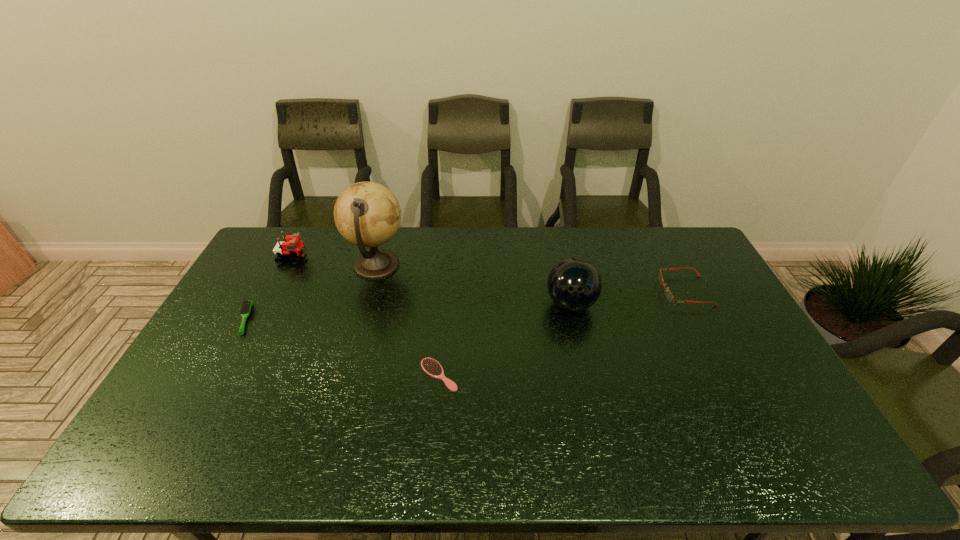
Locate an element on the screen. the tallest object is located at coordinates (367, 214).

Where is `the third object from left to right`? The width and height of the screenshot is (960, 540). the third object from left to right is located at coordinates (367, 214).

Where is `bowling ball`? bowling ball is located at coordinates (574, 285).

Locate an element on the screen. the second tallest object is located at coordinates (574, 285).

Find the location of a particular element. Lego is located at coordinates (292, 247).

The height and width of the screenshot is (540, 960). I want to click on spectacles, so click(669, 296).

Locate an element on the screen. Image resolution: width=960 pixels, height=540 pixels. the rightmost object is located at coordinates (669, 296).

What are the coordinates of `the left hairbrush` in the screenshot? It's located at (245, 309).

Find the location of `the fifth tallest object`. the fifth tallest object is located at coordinates (245, 309).

You are a GUI agent. You are given a task and a screenshot of the screen. Output one action in this format:
    pyautogui.click(x=<x>, y=<y>)
    Task: Click on the nearest object
    
    Given the screenshot: What is the action you would take?
    pyautogui.click(x=430, y=366)